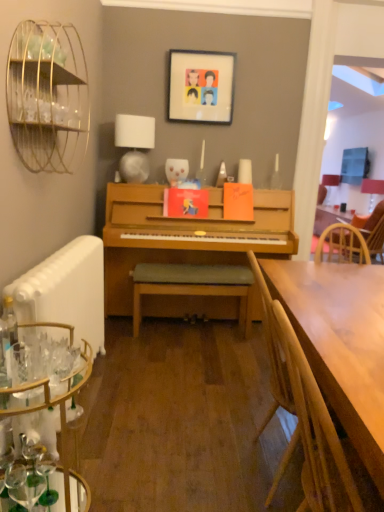
Question: Is the position of gold wire birdcage at upper left less distant than that of clear glass desk at lower left?

Choices:
 (A) no
 (B) yes

Answer: (A)

Question: From a real-world perspective, does gold wire birdcage at upper left stand above clear glass desk at lower left?

Choices:
 (A) yes
 (B) no

Answer: (A)

Question: Can you confirm if gold wire birdcage at upper left is shorter than clear glass desk at lower left?

Choices:
 (A) no
 (B) yes

Answer: (A)

Question: Can you confirm if gold wire birdcage at upper left is taller than clear glass desk at lower left?

Choices:
 (A) yes
 (B) no

Answer: (A)

Question: Can you confirm if gold wire birdcage at upper left is thinner than clear glass desk at lower left?

Choices:
 (A) no
 (B) yes

Answer: (B)

Question: Is wooden bench at center inside or outside of wooden chair at right, placed as the second chair when sorted from bottom to top?

Choices:
 (A) inside
 (B) outside

Answer: (B)

Question: Relative to wooden chair at right, placed as the second chair when sorted from bottom to top, is wooden bench at center in front or behind?

Choices:
 (A) front
 (B) behind

Answer: (A)

Question: From the image's perspective, relative to wooden chair at right, the 2th chair from the front, is wooden bench at center above or below?

Choices:
 (A) above
 (B) below

Answer: (B)

Question: Based on their sizes in the image, would you say wooden bench at center is bigger or smaller than wooden chair at right, the first chair viewed from the back?

Choices:
 (A) big
 (B) small

Answer: (B)

Question: Is wooden chair at right, which appears as the first chair when viewed from the front, to the left or to the right of white fabric lampshade at upper center, placed as the 2th lamp when sorted from back to front, in the image?

Choices:
 (A) right
 (B) left

Answer: (A)

Question: From a real-world perspective, relative to white fabric lampshade at upper center, which ranks as the 2th lamp in right-to-left order, is wooden chair at right, the second chair from the back, vertically above or below?

Choices:
 (A) below
 (B) above

Answer: (A)

Question: Is wooden chair at right, which appears as the first chair when ordered from the bottom, wider or thinner than white fabric lampshade at upper center, the first lamp in the front-to-back sequence?

Choices:
 (A) thin
 (B) wide

Answer: (B)

Question: In terms of size, does wooden chair at right, the second chair from the back, appear bigger or smaller than white fabric lampshade at upper center, the 1th lamp when ordered from left to right?

Choices:
 (A) big
 (B) small

Answer: (A)

Question: Looking at the image, does wooden chair at right, placed as the second chair when sorted from bottom to top, seem bigger or smaller compared to wooden bench at center?

Choices:
 (A) small
 (B) big

Answer: (B)

Question: Is wooden chair at right, the first chair viewed from the back, taller or shorter than wooden bench at center?

Choices:
 (A) short
 (B) tall

Answer: (B)